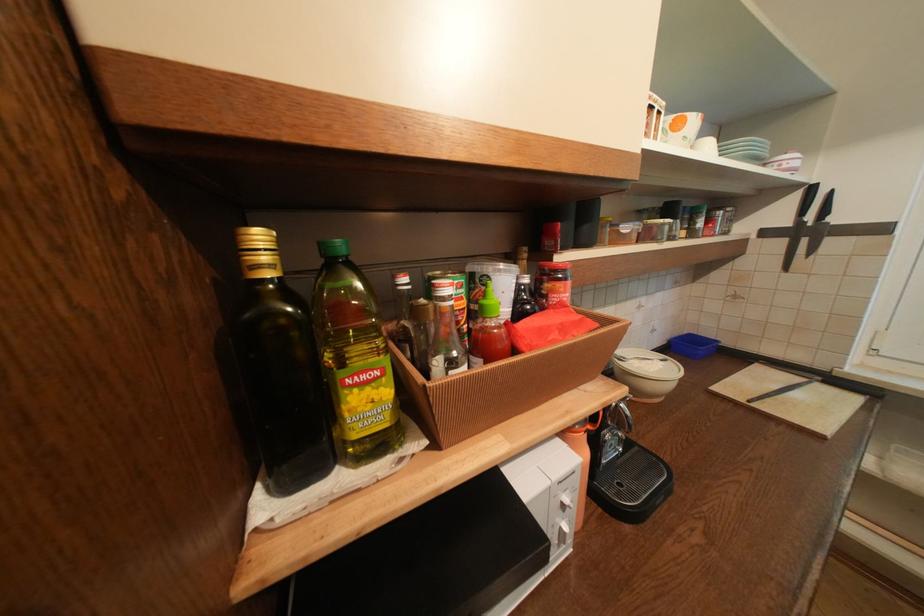
Image resolution: width=924 pixels, height=616 pixels. What are the coordinates of `beige bowl lid` in the screenshot? It's located at (646, 373).